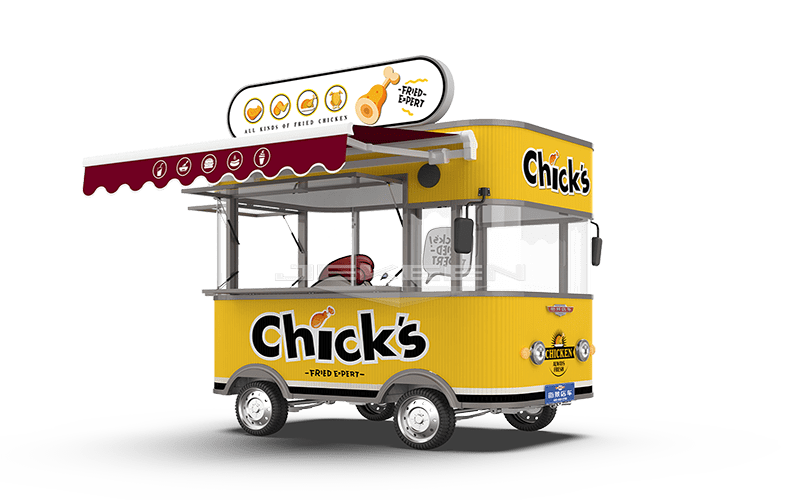
This screenshot has width=800, height=500. Identify the location of shade. (258, 160).